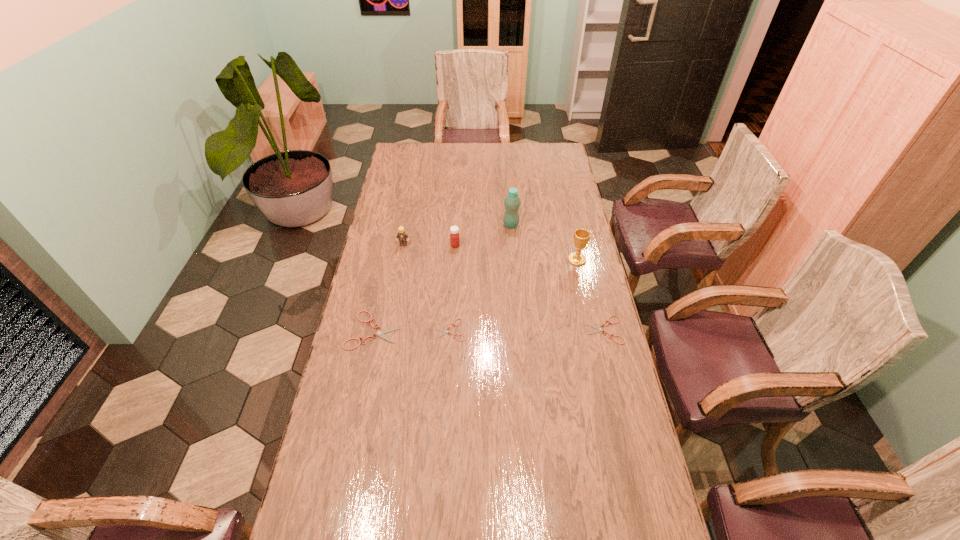
Image resolution: width=960 pixels, height=540 pixels. In order to click on the tallest shears in this screenshot , I will do `click(381, 333)`.

Identify the location of the leftmost shears. The image size is (960, 540). (381, 333).

Identify the location of the second shears from right to left. (445, 331).

You are a GUI agent. You are given a task and a screenshot of the screen. Output one action in this format:
    pyautogui.click(x=<x>, y=<y>)
    Task: Click on the shortest shears
    This screenshot has width=960, height=540.
    Given the screenshot: What is the action you would take?
    pyautogui.click(x=445, y=331)

Identify the location of the rightmost shears. Image resolution: width=960 pixels, height=540 pixels. (599, 329).

The width and height of the screenshot is (960, 540). Find the location of `the second tallest shears`. the second tallest shears is located at coordinates (599, 329).

This screenshot has height=540, width=960. Find the location of `Lego`. Lego is located at coordinates (402, 235).

Find the location of `the farthest object`. the farthest object is located at coordinates (512, 202).

What are the coordinates of `water bottle` in the screenshot? It's located at (512, 202).

Where is `the sixth shortest object`? The image size is (960, 540). the sixth shortest object is located at coordinates (581, 236).